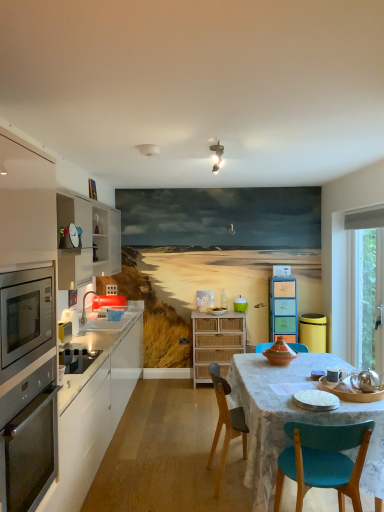
Question: Is metallic microwave at center-left, the 3th appliance positioned from the left, to the right of pastel wood drawers at center, the 3th cabinetry in the left-to-right sequence, from the viewer's perspective?

Choices:
 (A) yes
 (B) no

Answer: (A)

Question: Is metallic microwave at center-left, which is the first appliance in top-to-bottom order, completely or partially outside of pastel wood drawers at center, positioned as the 1th cabinetry in right-to-left order?

Choices:
 (A) yes
 (B) no

Answer: (A)

Question: Does metallic microwave at center-left, which is the first appliance in top-to-bottom order, have a greater width compared to pastel wood drawers at center, positioned as the 1th cabinetry in right-to-left order?

Choices:
 (A) no
 (B) yes

Answer: (A)

Question: Does metallic microwave at center-left, marked as the first appliance in a back-to-front arrangement, have a lesser height compared to pastel wood drawers at center, the 3th cabinetry in the left-to-right sequence?

Choices:
 (A) yes
 (B) no

Answer: (A)

Question: Is metallic microwave at center-left, the 3th appliance positioned from the left, far away from pastel wood drawers at center, positioned as the 1th cabinetry in right-to-left order?

Choices:
 (A) no
 (B) yes

Answer: (A)

Question: Is metallic stainless steel oven at left in front of or behind transparent glass window at right in the image?

Choices:
 (A) front
 (B) behind

Answer: (A)

Question: In terms of size, does metallic stainless steel oven at left appear bigger or smaller than transparent glass window at right?

Choices:
 (A) big
 (B) small

Answer: (B)

Question: Based on their positions, is metallic stainless steel oven at left located to the left or right of transparent glass window at right?

Choices:
 (A) right
 (B) left

Answer: (B)

Question: Is point (13, 424) positioned closer to the camera than point (365, 354)?

Choices:
 (A) closer
 (B) farther

Answer: (A)

Question: Does point (33, 439) appear closer or farther from the camera than point (102, 301)?

Choices:
 (A) farther
 (B) closer

Answer: (B)

Question: From a real-world perspective, is metallic stainless steel oven at left above or below white glossy sink at left?

Choices:
 (A) below
 (B) above

Answer: (A)

Question: Is metallic stainless steel oven at left wider or thinner than white glossy sink at left?

Choices:
 (A) thin
 (B) wide

Answer: (A)

Question: Is metallic stainless steel oven at left in front of or behind white glossy sink at left in the image?

Choices:
 (A) behind
 (B) front

Answer: (B)

Question: In the image, is teal plastic container at center on the left side or the right side of white matte cabinet at left, which is the first cabinetry from left to right?

Choices:
 (A) right
 (B) left

Answer: (A)

Question: In terms of height, does teal plastic container at center look taller or shorter compared to white matte cabinet at left, which is the first cabinetry from left to right?

Choices:
 (A) tall
 (B) short

Answer: (B)